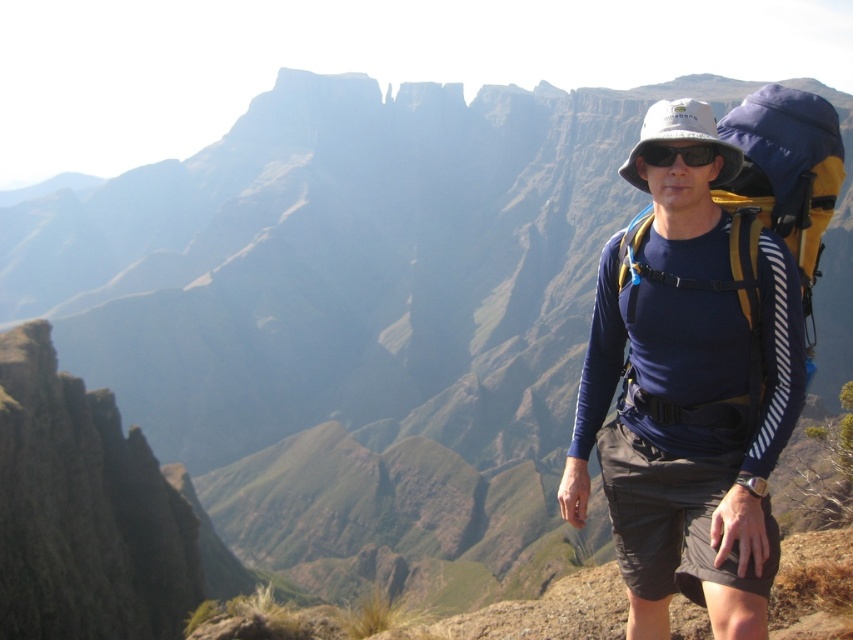
Consider the image. You are a photographer trying to capture the hiker in the image. The hiker is wearing a blue fabric shirt at center. If you want to focus your camera on the hiker, which object should you adjust your lens to?

You should adjust your lens to focus on the blue fabric shirt at center since it is located at point [689,392], which is the position of the hiker in the image.